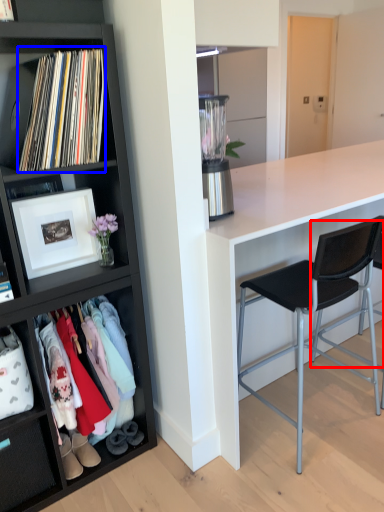
Question: Which object is closer to the camera taking this photo, chair (highlighted by a red box) or book (highlighted by a blue box)?

Choices:
 (A) chair
 (B) book

Answer: (B)